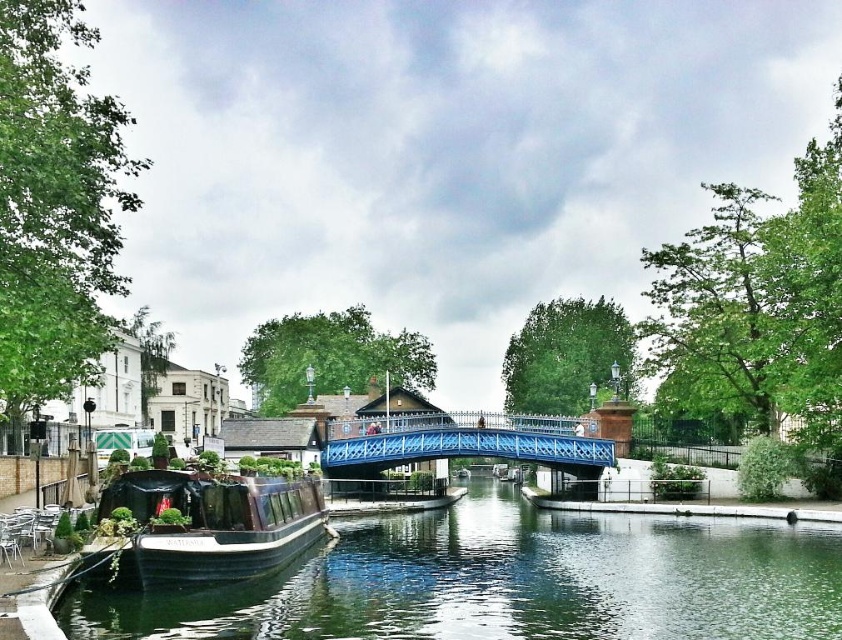
Question: Which of the following is the farthest from the observer?

Choices:
 (A) (269, 536)
 (B) (517, 536)
 (C) (473, 445)

Answer: (C)

Question: Which of the following is the farthest from the observer?

Choices:
 (A) (185, 582)
 (B) (467, 632)
 (C) (530, 444)

Answer: (C)

Question: Which point is closer to the camera?

Choices:
 (A) (237, 564)
 (B) (609, 586)

Answer: (A)

Question: Is smooth black boat at lower left above blue metallic bridge at center?

Choices:
 (A) yes
 (B) no

Answer: (B)

Question: Considering the relative positions of smooth black boat at lower left and wooden polished boat at lower left in the image provided, where is smooth black boat at lower left located with respect to wooden polished boat at lower left?

Choices:
 (A) below
 (B) above

Answer: (A)

Question: In this image, where is smooth black boat at lower left located relative to wooden polished boat at lower left?

Choices:
 (A) below
 (B) above

Answer: (A)